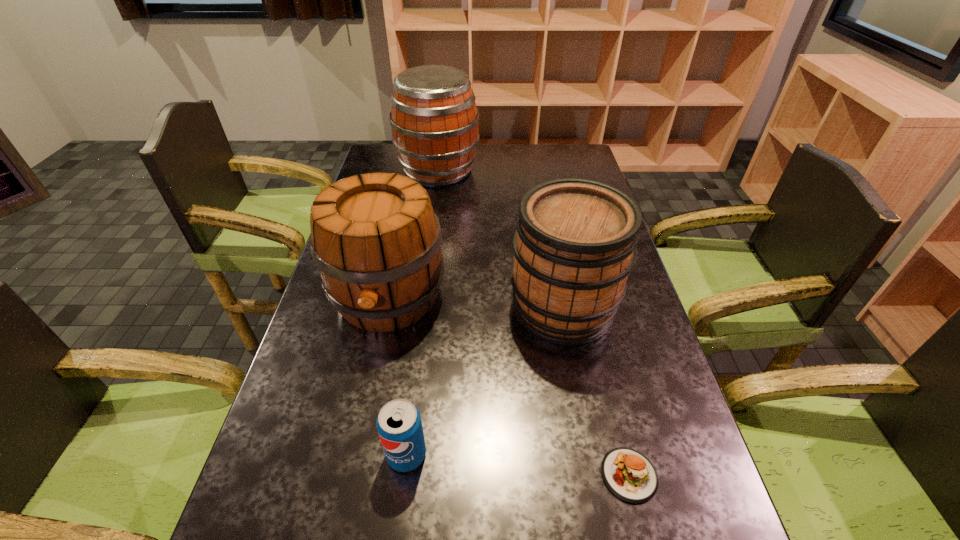
Where is `patty (food) that is at the right edge`? The height and width of the screenshot is (540, 960). patty (food) that is at the right edge is located at coordinates (629, 475).

The image size is (960, 540). Identify the location of object that is positioned at the far left corner. (435, 122).

What are the coordinates of `vacant space at the far edge of the desktop` in the screenshot? It's located at (534, 148).

Locate an element on the screen. free region at the left edge is located at coordinates (320, 380).

Locate an element on the screen. The width and height of the screenshot is (960, 540). free spot at the far left corner of the desktop is located at coordinates (383, 156).

At what (x,y) coordinates should I click in order to perform the action: click on vacant space at the far right corner of the desktop. Please return your answer as a coordinate pair (x, y). Looking at the image, I should click on (583, 145).

Identify the location of free space between the farthest object and the rightmost cider. (500, 239).

You are a GUI agent. You are given a task and a screenshot of the screen. Output one action in this format:
    pyautogui.click(x=<x>, y=<y>)
    Task: Click on the free space that is in between the soda can and the rightmost cider
    
    Given the screenshot: What is the action you would take?
    click(485, 381)

Where is `free area in between the shortest object and the rightmost cider`? free area in between the shortest object and the rightmost cider is located at coordinates (596, 391).

Where is `object that is the fourth closest to the farthest object`? Image resolution: width=960 pixels, height=540 pixels. object that is the fourth closest to the farthest object is located at coordinates (629, 475).